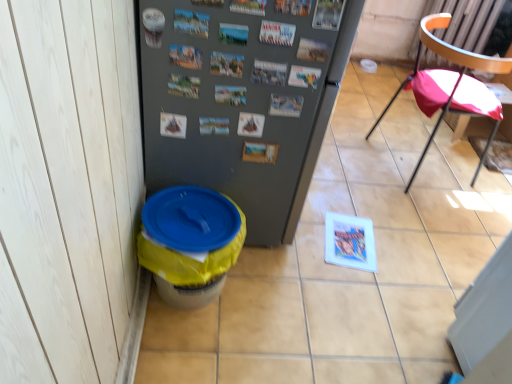
Where is `vacant space behind pink fabric chair at right`? vacant space behind pink fabric chair at right is located at coordinates (391, 119).